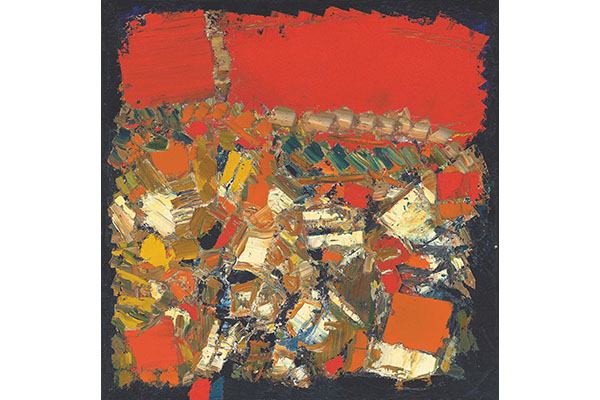
The height and width of the screenshot is (400, 600). I want to click on beige paint, so click(414, 222).